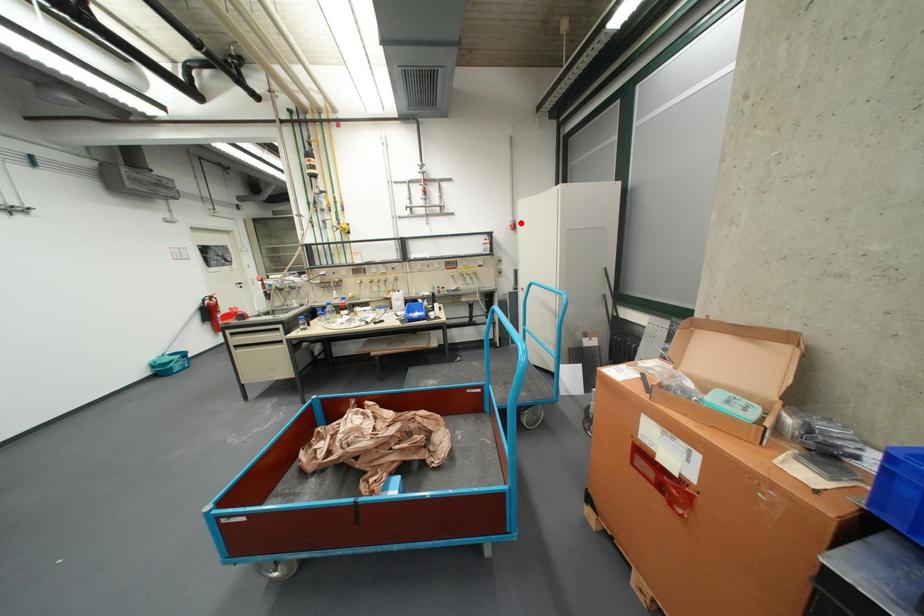
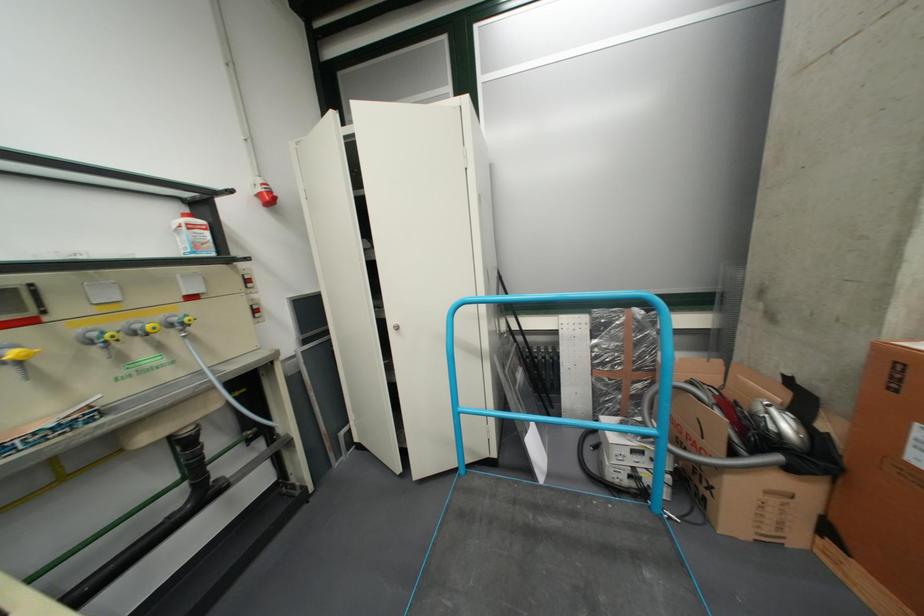
Question: I am providing you with two images of the same scene from different viewpoints. In image1, a red point is highlighted. Considering the same 3D point in image2, which of the following is correct?

Choices:
 (A) It is closer
 (B) It is farther

Answer: (B)